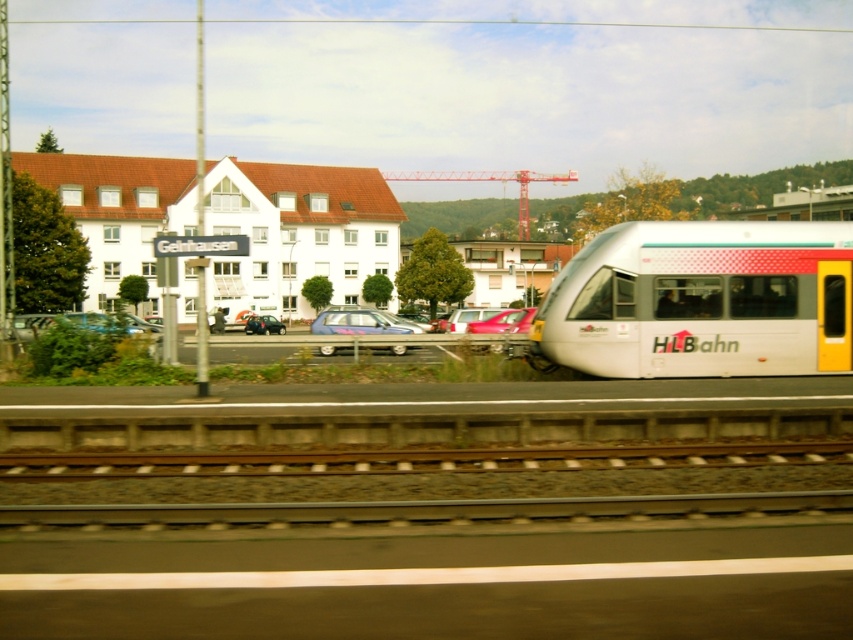
Between metallic silver car at center and matte black car at center, which one appears on the left side from the viewer's perspective?

From the viewer's perspective, matte black car at center appears more on the left side.

Is point (363, 310) positioned behind point (282, 330)?

No, (363, 310) is closer to viewer.

Which is in front, point (393, 332) or point (280, 328)?

Positioned in front is point (393, 332).

This screenshot has height=640, width=853. In order to click on metallic silver car at center in this screenshot , I will do `click(357, 323)`.

Between white glossy train at right and matte black car at center, which one appears on the right side from the viewer's perspective?

Positioned to the right is white glossy train at right.

Does white glossy train at right appear on the left side of matte black car at center?

In fact, white glossy train at right is to the right of matte black car at center.

Who is more distant from viewer, (766, 243) or (268, 332)?

The point (268, 332) is more distant.

The height and width of the screenshot is (640, 853). Identify the location of white glossy train at right. (701, 300).

Does shiny red sedan at center appear over matte black car at center?

Yes, shiny red sedan at center is above matte black car at center.

Which of these two, shiny red sedan at center or matte black car at center, stands shorter?

shiny red sedan at center is shorter.

Where is `shiny red sedan at center`? The height and width of the screenshot is (640, 853). shiny red sedan at center is located at coordinates (498, 321).

This screenshot has width=853, height=640. Find the location of `shiny red sedan at center`. shiny red sedan at center is located at coordinates (498, 321).